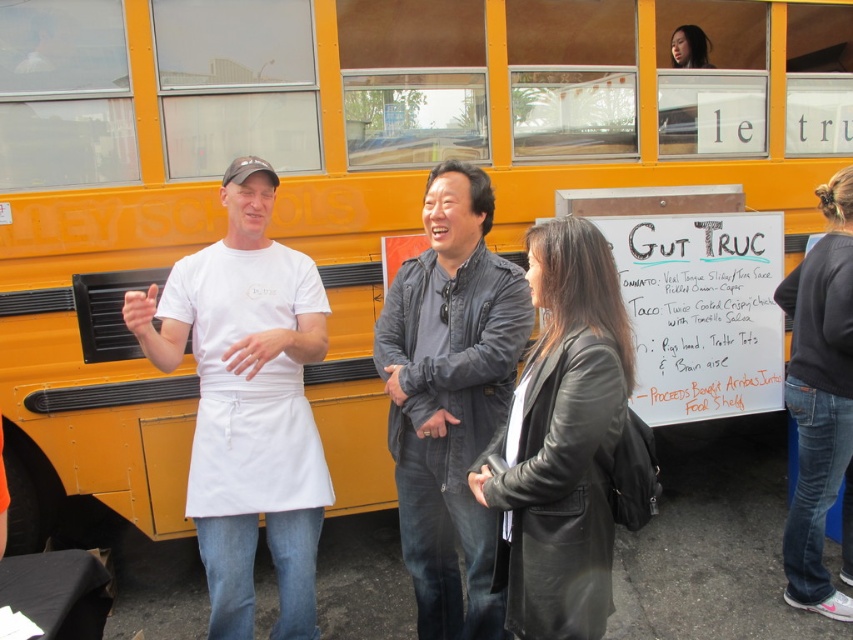
You are a photographer trying to capture a photo of the two jackets in the scene. Since you want both jackets to be visible in the frame, which direction should you face to ensure you can see both the dark gray leather jacket at center and the black leather jacket at center?

You should face towards the right side of the scene so that both the dark gray leather jacket at center and the black leather jacket at center are visible in your frame, as the dark gray leather jacket at center is positioned to the left of the black leather jacket at center.

You are a photographer trying to capture a photo of the dark gray leather jacket at center and the dark gray sweater at lower right. Which object should you focus on first if you want to include both in your shot without moving the camera?

The dark gray leather jacket at center is not as tall as the dark gray sweater at lower right, so you should focus on the dark gray sweater at lower right first because it is taller and will require more space in the frame.

You are a photographer trying to capture a photo of the dark gray leather jacket at center while avoiding the school bus in the background. Based on its position, where should you aim your camera?

The dark gray leather jacket at center is located at coordinates approximately 0.622 on the x axis and 0.529 on the y axis, so you should aim your camera at that point to capture it without the school bus in the background.